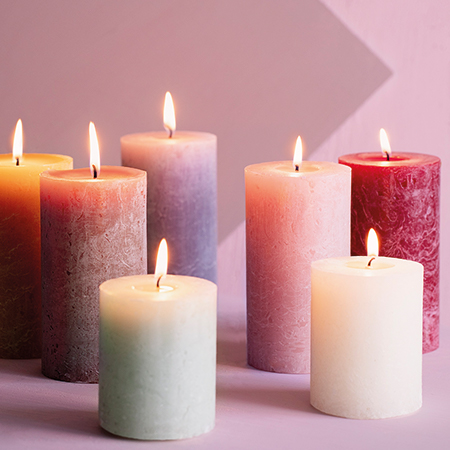
Find the location of a particular element. This screenshot has height=450, width=450. taller candle is located at coordinates (19, 202), (68, 250), (175, 173), (304, 233), (413, 200).